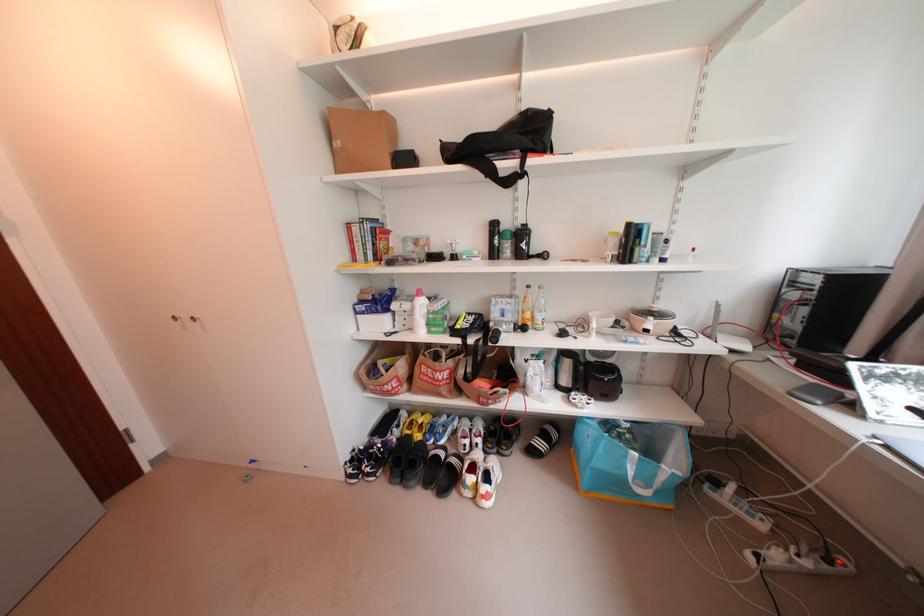
This screenshot has height=616, width=924. What do you see at coordinates (646, 476) in the screenshot? I see `the blue bag handle` at bounding box center [646, 476].